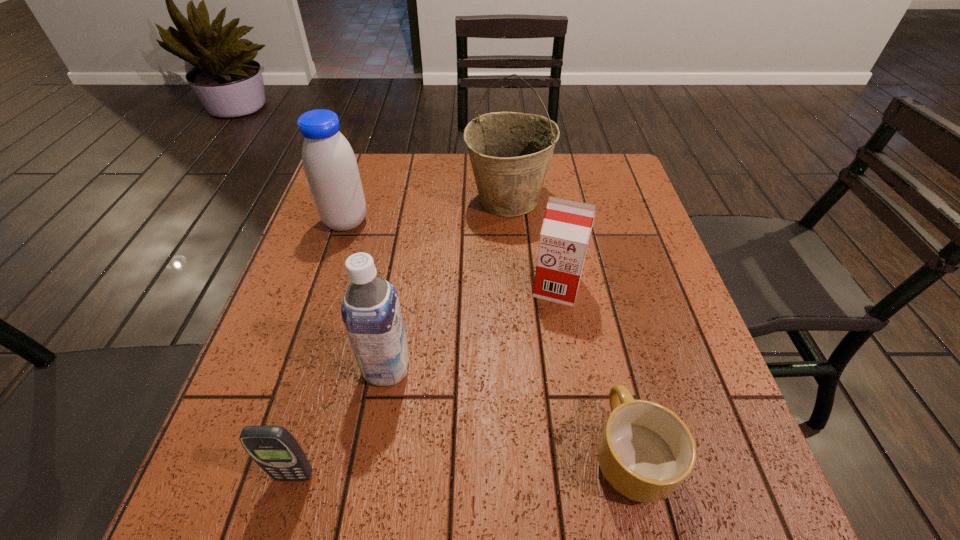
The height and width of the screenshot is (540, 960). Identify the location of object that is at the right edge. (645, 452).

Where is `object positioned at the near left corner`? The height and width of the screenshot is (540, 960). object positioned at the near left corner is located at coordinates (273, 448).

Locate an element on the screen. object that is at the near right corner is located at coordinates (645, 452).

Find the location of a particular element. blank space at the far edge of the desktop is located at coordinates (396, 154).

In the image, there is a desktop. Find the location of `vacant space at the near edge`. vacant space at the near edge is located at coordinates (507, 478).

Locate an element on the screen. The height and width of the screenshot is (540, 960). vacant space at the left edge of the desktop is located at coordinates (325, 264).

Image resolution: width=960 pixels, height=540 pixels. In the image, there is a desktop. Find the location of `free space at the right edge`. free space at the right edge is located at coordinates (626, 332).

In the image, there is a desktop. Where is `free space at the far right corner`? free space at the far right corner is located at coordinates (592, 158).

Find the location of a particular element. Image resolution: width=960 pixels, height=540 pixels. free space between the fifth tallest object and the shortest object is located at coordinates (463, 464).

Where is `vacant space that's between the third object from left to right and the wine bucket`? This screenshot has height=540, width=960. vacant space that's between the third object from left to right and the wine bucket is located at coordinates (447, 284).